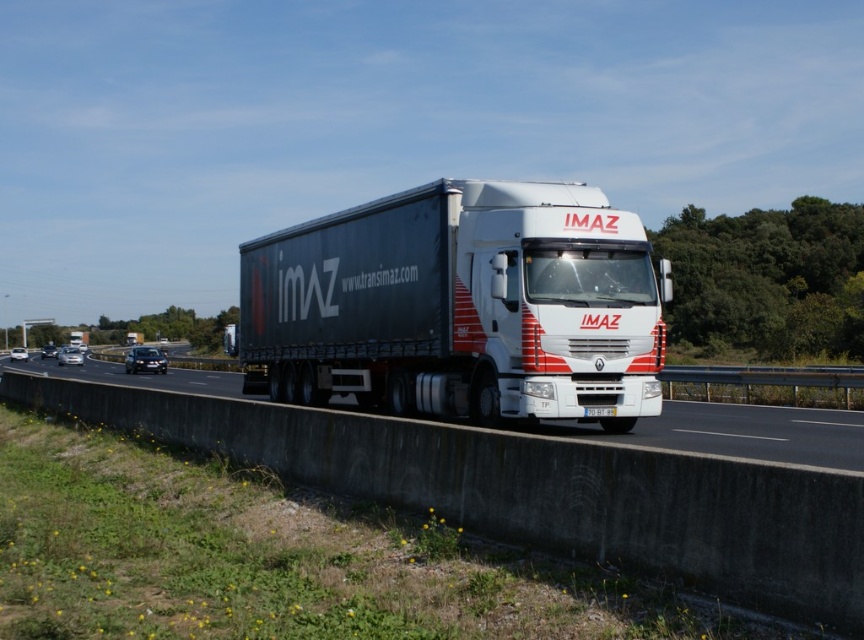
Question: Is matte black trailer truck at center thinner than white glossy truck at center?

Choices:
 (A) yes
 (B) no

Answer: (A)

Question: Does matte black trailer truck at center appear on the left side of white glossy truck at center?

Choices:
 (A) no
 (B) yes

Answer: (A)

Question: Is matte black trailer truck at center further to the viewer compared to white glossy truck at center?

Choices:
 (A) yes
 (B) no

Answer: (A)

Question: Which point appears closest to the camera in this image?

Choices:
 (A) 693,412
 (B) 513,227

Answer: (B)

Question: Which point is closer to the camera?

Choices:
 (A) (643, 438)
 (B) (510, 189)

Answer: (A)